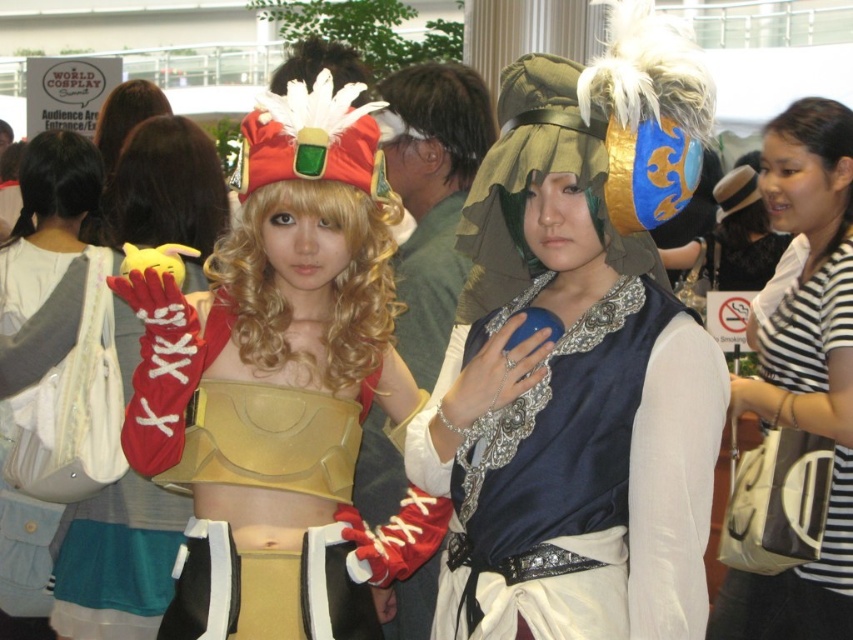
You are at the World Cosplay Summit and see two points marked on the ground. One is at point (154, 145) and the other is at point (503, 196). If you are facing the front of the image, which point is closer to you?

Point (503, 196) is closer to you because it is in front of point (154, 145).

You are a photographer at the World Cosplay Summit. You want to take a photo of the matte gold armor at center and the red leather glove at left. The minimum distance required between the two objects for your camera to focus properly is 6 feet. Will the current positioning allow for proper focus?

The distance between the matte gold armor at center and the red leather glove at left is 5.80 feet, which is less than the required 6 feet. Therefore, the current positioning will not allow for proper focus.